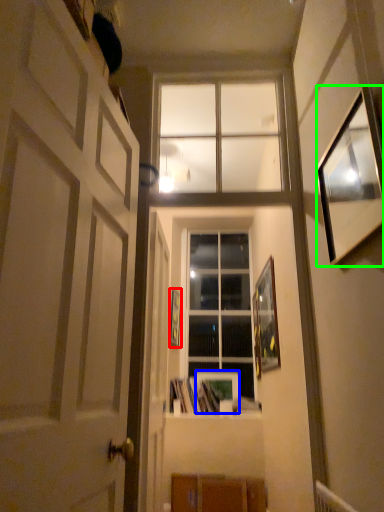
Question: Which is farther away from picture frame (highlighted by a red box)? picture frame (highlighted by a blue box) or picture frame (highlighted by a green box)?

Choices:
 (A) picture frame
 (B) picture frame

Answer: (B)